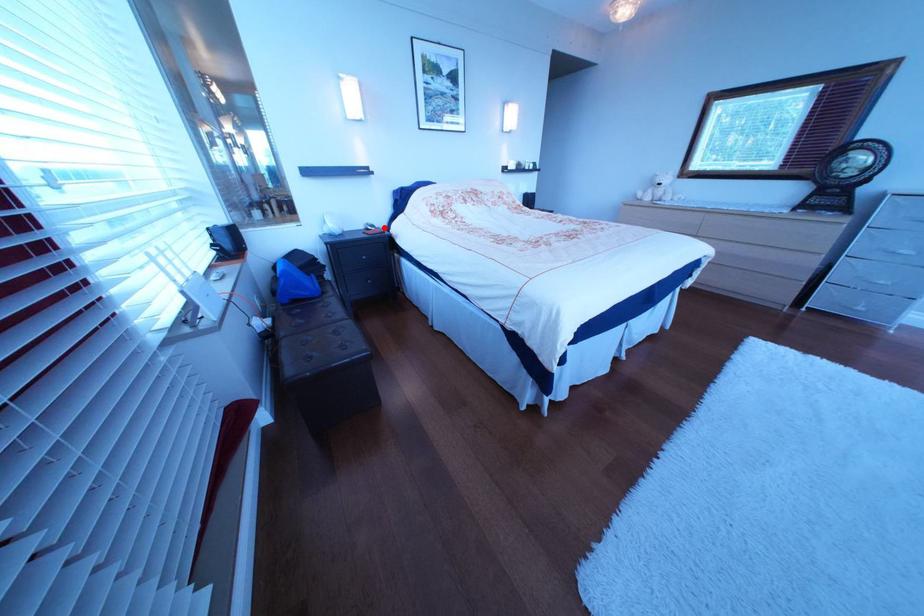
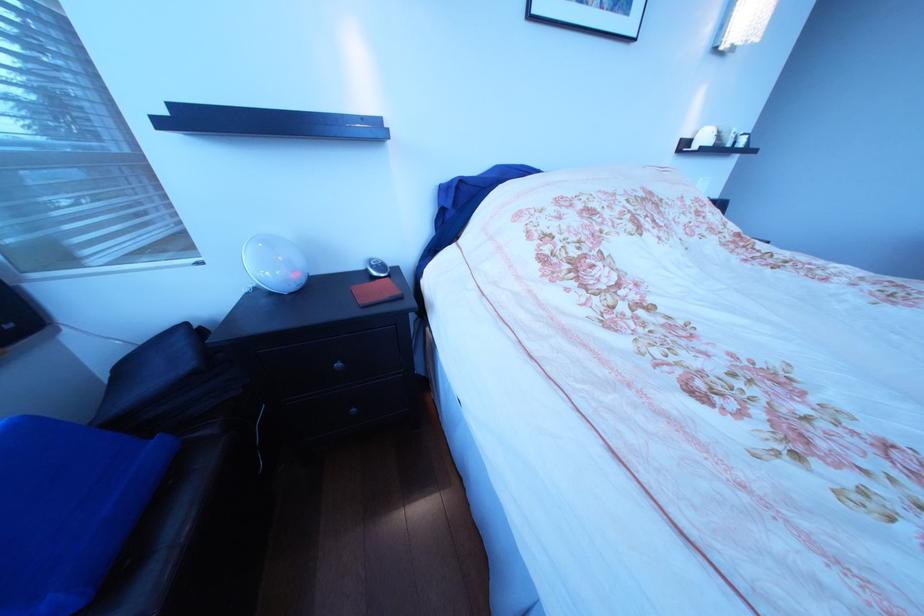
Question: I am providing you with two images of the same scene from different viewpoints. Given a red point in image1, look at the same physical point in image2. Is it:

Choices:
 (A) Closer to the viewpoint
 (B) Farther from the viewpoint

Answer: (B)